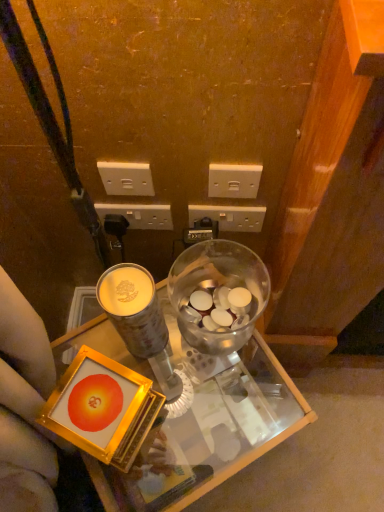
The width and height of the screenshot is (384, 512). I want to click on free space in front of matte gold coffee cup at center, so click(181, 422).